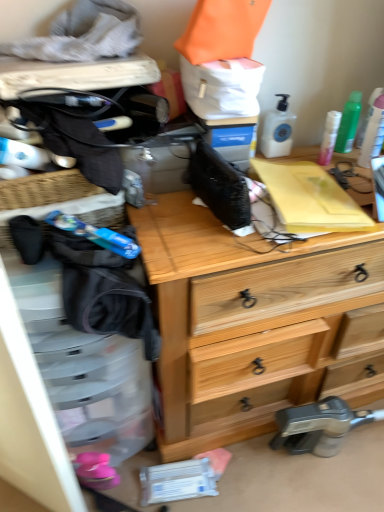
Question: From a real-world perspective, does green plastic spray can at upper right, marked as the 1th toiletry in a right-to-left arrangement, stand above white plastic pump bottle at upper right, arranged as the 4th toiletry when viewed from the right?

Choices:
 (A) yes
 (B) no

Answer: (A)

Question: Is white plastic pump bottle at upper right, the first toiletry from the left, inside green plastic spray can at upper right, acting as the fourth toiletry starting from the left?

Choices:
 (A) no
 (B) yes

Answer: (A)

Question: Does green plastic spray can at upper right, acting as the fourth toiletry starting from the left, have a lesser height compared to white plastic pump bottle at upper right, the first toiletry from the left?

Choices:
 (A) no
 (B) yes

Answer: (A)

Question: Is green plastic spray can at upper right, marked as the 1th toiletry in a right-to-left arrangement, oriented away from white plastic pump bottle at upper right, the first toiletry from the left?

Choices:
 (A) yes
 (B) no

Answer: (B)

Question: Can you confirm if green plastic spray can at upper right, marked as the 1th toiletry in a right-to-left arrangement, is taller than white plastic pump bottle at upper right, the first toiletry from the left?

Choices:
 (A) yes
 (B) no

Answer: (A)

Question: Considering their positions, is white plastic pump bottle at upper right, the first toiletry from the left, located in front of or behind green plastic spray can at upper right, acting as the fourth toiletry starting from the left?

Choices:
 (A) behind
 (B) front

Answer: (A)

Question: Is white plastic pump bottle at upper right, arranged as the 4th toiletry when viewed from the right, spatially inside green plastic spray can at upper right, marked as the 1th toiletry in a right-to-left arrangement, or outside of it?

Choices:
 (A) outside
 (B) inside

Answer: (A)

Question: In terms of size, does white plastic pump bottle at upper right, the first toiletry from the left, appear bigger or smaller than green plastic spray can at upper right, marked as the 1th toiletry in a right-to-left arrangement?

Choices:
 (A) big
 (B) small

Answer: (A)

Question: Would you say white plastic pump bottle at upper right, the first toiletry from the left, is to the left or to the right of green plastic spray can at upper right, marked as the 1th toiletry in a right-to-left arrangement, in the picture?

Choices:
 (A) left
 (B) right

Answer: (A)

Question: From a real-world perspective, relative to green plastic spray can at upper right, acting as the fourth toiletry starting from the left, is wooden chest of drawers at center vertically above or below?

Choices:
 (A) above
 (B) below

Answer: (B)

Question: In the image, is wooden chest of drawers at center on the left side or the right side of green plastic spray can at upper right, marked as the 1th toiletry in a right-to-left arrangement?

Choices:
 (A) right
 (B) left

Answer: (B)

Question: Considering the positions of wooden chest of drawers at center and green plastic spray can at upper right, acting as the fourth toiletry starting from the left, in the image, is wooden chest of drawers at center wider or thinner than green plastic spray can at upper right, acting as the fourth toiletry starting from the left,?

Choices:
 (A) wide
 (B) thin

Answer: (A)

Question: Is wooden chest of drawers at center taller or shorter than green plastic spray can at upper right, marked as the 1th toiletry in a right-to-left arrangement?

Choices:
 (A) tall
 (B) short

Answer: (A)

Question: From a real-world perspective, is pink matte lotion at upper right, the 3th toiletry viewed from the right, positioned above or below wooden chest of drawers at center?

Choices:
 (A) above
 (B) below

Answer: (A)

Question: From the image's perspective, is pink matte lotion at upper right, marked as the second toiletry in a left-to-right arrangement, positioned above or below wooden chest of drawers at center?

Choices:
 (A) above
 (B) below

Answer: (A)